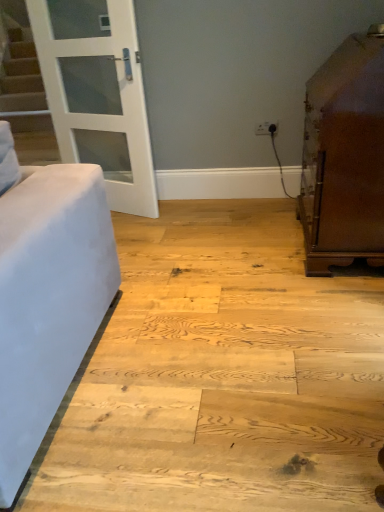
Question: Considering the relative sizes of brown polished cabinet at right and white plastic outlet at upper center in the image provided, is brown polished cabinet at right smaller than white plastic outlet at upper center?

Choices:
 (A) yes
 (B) no

Answer: (B)

Question: Does brown polished cabinet at right appear on the right side of white plastic outlet at upper center?

Choices:
 (A) no
 (B) yes

Answer: (B)

Question: From the image's perspective, is brown polished cabinet at right located beneath white plastic outlet at upper center?

Choices:
 (A) no
 (B) yes

Answer: (B)

Question: From a real-world perspective, is brown polished cabinet at right beneath white plastic outlet at upper center?

Choices:
 (A) yes
 (B) no

Answer: (B)

Question: From the image's perspective, is brown polished cabinet at right over white plastic outlet at upper center?

Choices:
 (A) yes
 (B) no

Answer: (B)

Question: Can you confirm if brown polished cabinet at right is shorter than white plastic outlet at upper center?

Choices:
 (A) no
 (B) yes

Answer: (A)

Question: Considering the relative sizes of white plastic outlet at upper center and white glass door at upper left in the image provided, is white plastic outlet at upper center shorter than white glass door at upper left?

Choices:
 (A) no
 (B) yes

Answer: (B)

Question: Is white glass door at upper left located within white plastic outlet at upper center?

Choices:
 (A) yes
 (B) no

Answer: (B)

Question: From the image's perspective, is white plastic outlet at upper center located above white glass door at upper left?

Choices:
 (A) no
 (B) yes

Answer: (A)

Question: Is white plastic outlet at upper center in contact with white glass door at upper left?

Choices:
 (A) no
 (B) yes

Answer: (A)

Question: Is white plastic outlet at upper center behind white glass door at upper left?

Choices:
 (A) yes
 (B) no

Answer: (A)

Question: Is white plastic outlet at upper center facing towards white glass door at upper left?

Choices:
 (A) no
 (B) yes

Answer: (A)

Question: Considering the relative sizes of white plastic outlet at upper center and brown polished cabinet at right in the image provided, is white plastic outlet at upper center shorter than brown polished cabinet at right?

Choices:
 (A) no
 (B) yes

Answer: (B)